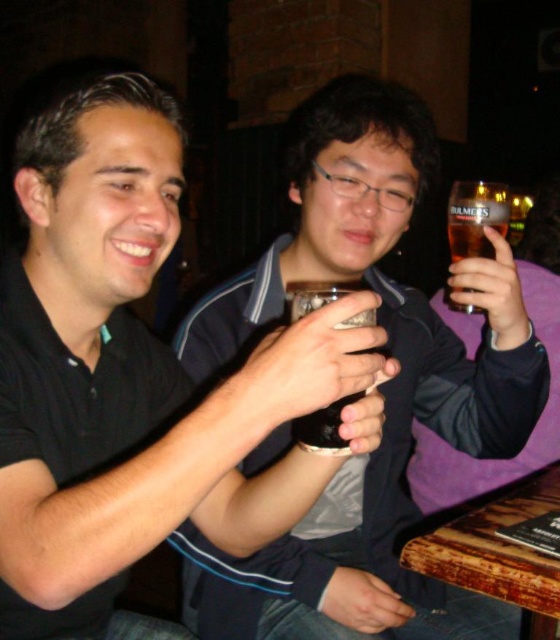
Looking at this image, can you confirm if matte black mug at center is bigger than clear glass mug at upper right?

Yes.

Is matte black mug at center positioned behind clear glass mug at upper right?

No, matte black mug at center is closer to the viewer.

Is point (188, 460) positioned before point (474, 186)?

Yes, point (188, 460) is closer to viewer.

Image resolution: width=560 pixels, height=640 pixels. In order to click on matte black mug at center in this screenshot , I will do `click(130, 371)`.

Does matte glass mug at center appear under dark brown glass at center?

Correct, matte glass mug at center is located below dark brown glass at center.

Can you confirm if matte glass mug at center is smaller than dark brown glass at center?

Actually, matte glass mug at center might be larger than dark brown glass at center.

Locate an element on the screen. The image size is (560, 640). matte glass mug at center is located at coordinates click(x=380, y=387).

Does clear glass mug at upper right have a greater width compared to dark brown glass at center?

Yes.

Is point (478, 200) farther from viewer compared to point (305, 305)?

Yes, it is.

Locate an element on the screen. The width and height of the screenshot is (560, 640). clear glass mug at upper right is located at coordinates (476, 218).

At what (x,y) coordinates should I click in order to perform the action: click on clear glass mug at upper right. Please return your answer as a coordinate pair (x, y). The width and height of the screenshot is (560, 640). Looking at the image, I should click on (476, 218).